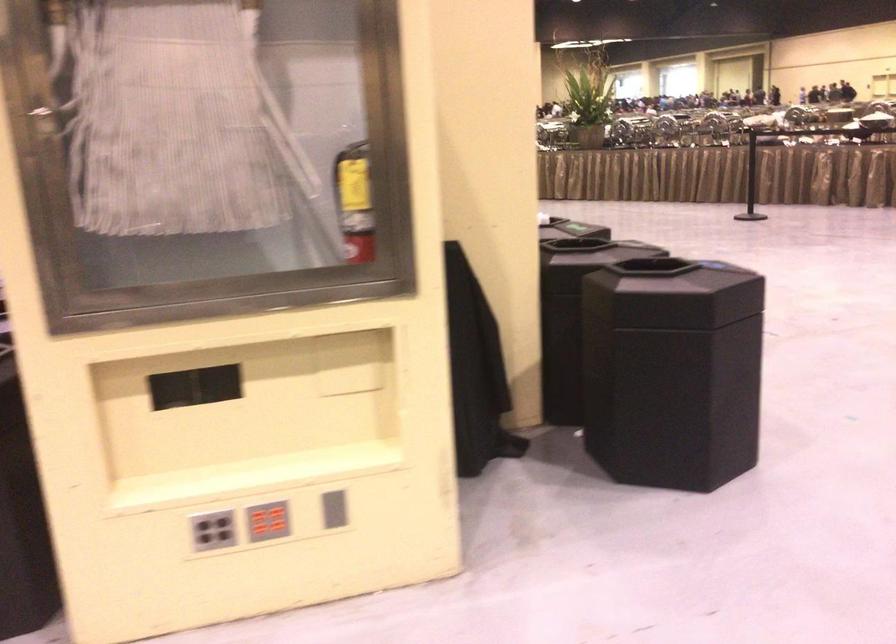
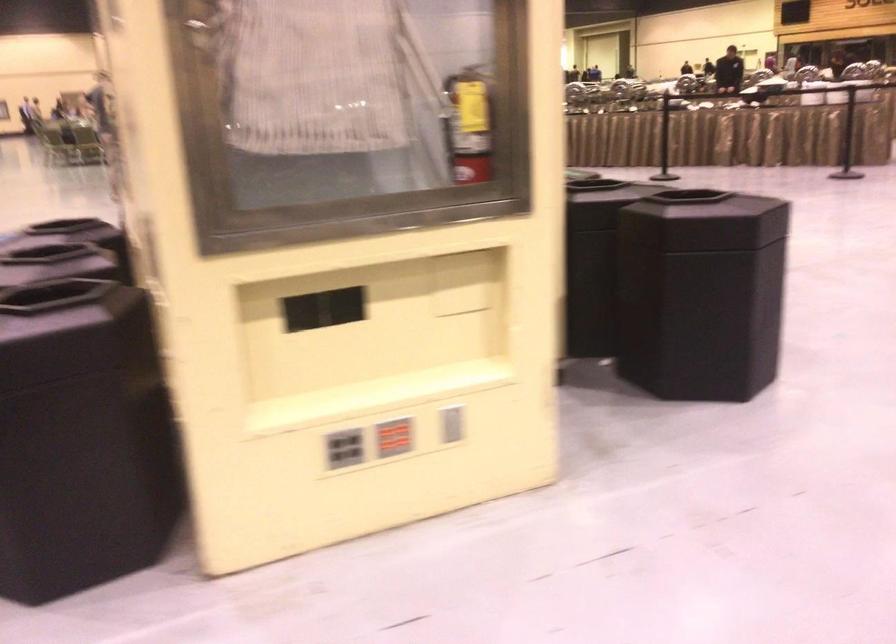
Question: Which direction would the cameraman need to move to produce the second image? Reply with the corresponding letter.

Choices:
 (A) Left
 (B) Right
 (C) Forward
 (D) Backward

Answer: (A)